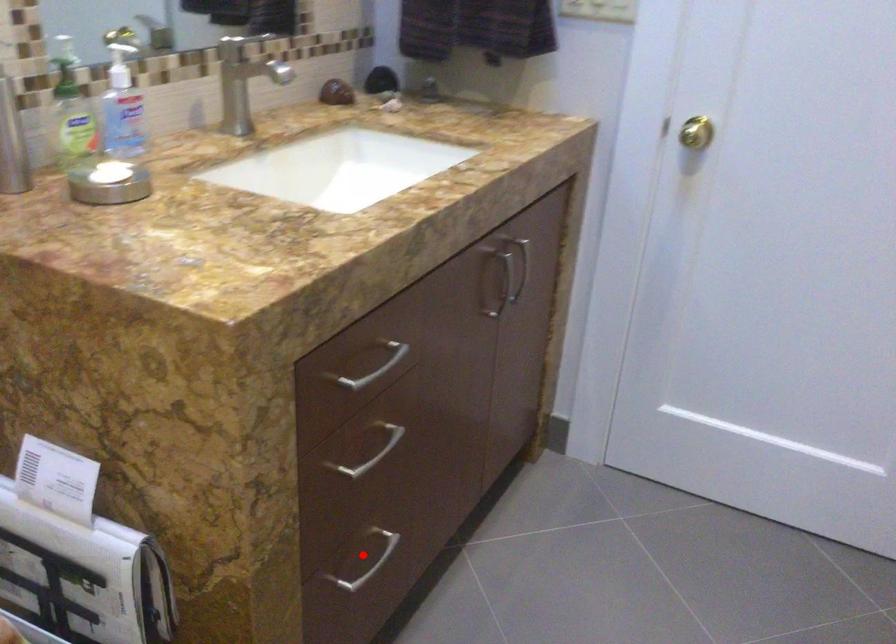
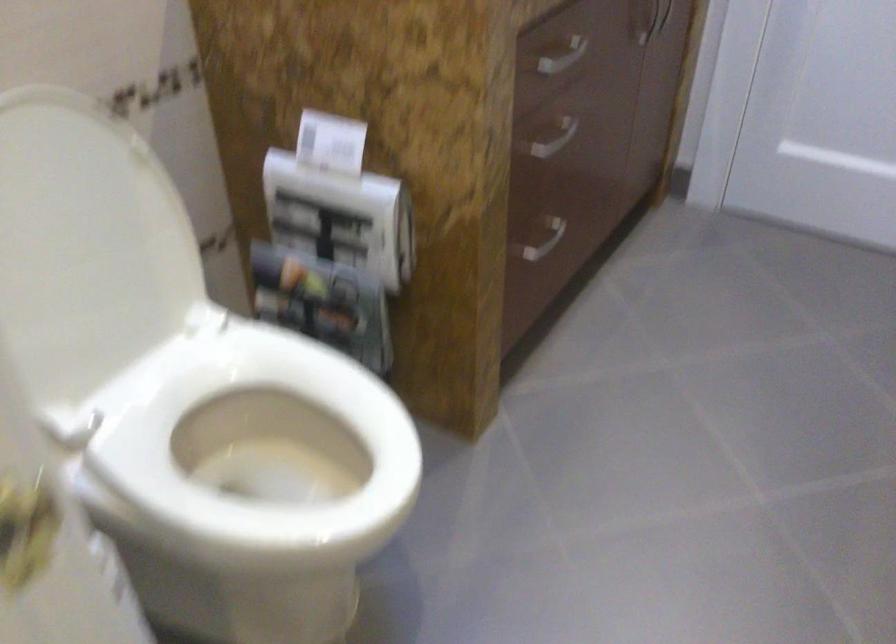
Question: I am providing you with two images of the same scene from different viewpoints. A red point is shown in image1. For the corresponding object point in image2, is it positioned nearer or farther from the camera?

Choices:
 (A) Nearer
 (B) Farther

Answer: (B)